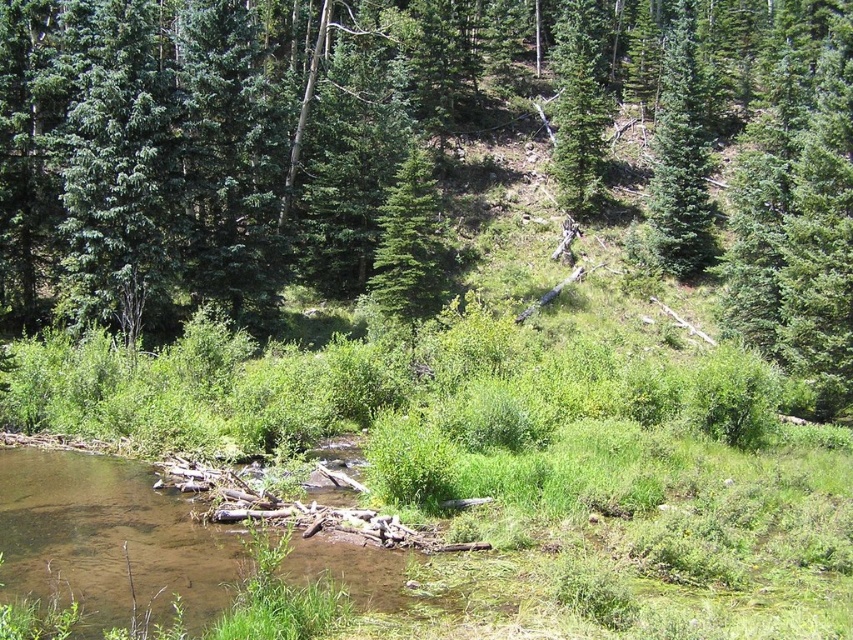
Question: Is green leafy tree at center to the right of brown muddy water at lower left from the viewer's perspective?

Choices:
 (A) yes
 (B) no

Answer: (A)

Question: Does green leafy tree at center have a larger size compared to green fir tree at upper right?

Choices:
 (A) no
 (B) yes

Answer: (B)

Question: Among these objects, which one is farthest from the camera?

Choices:
 (A) green fir tree at upper right
 (B) green matte tree at center
 (C) brown muddy water at lower left
 (D) green leafy tree at center

Answer: (A)

Question: Among these points, which one is nearest to the camera?

Choices:
 (A) (439, 282)
 (B) (648, 221)
 (C) (541, 44)
 (D) (578, 88)

Answer: (A)

Question: Considering the real-world distances, which object is farthest from the green leafy tree at center?

Choices:
 (A) green matte tree at upper center
 (B) brown muddy water at lower left
 (C) green matte tree at center

Answer: (B)

Question: Can you confirm if green leafy tree at center is positioned below brown muddy water at lower left?

Choices:
 (A) no
 (B) yes

Answer: (A)